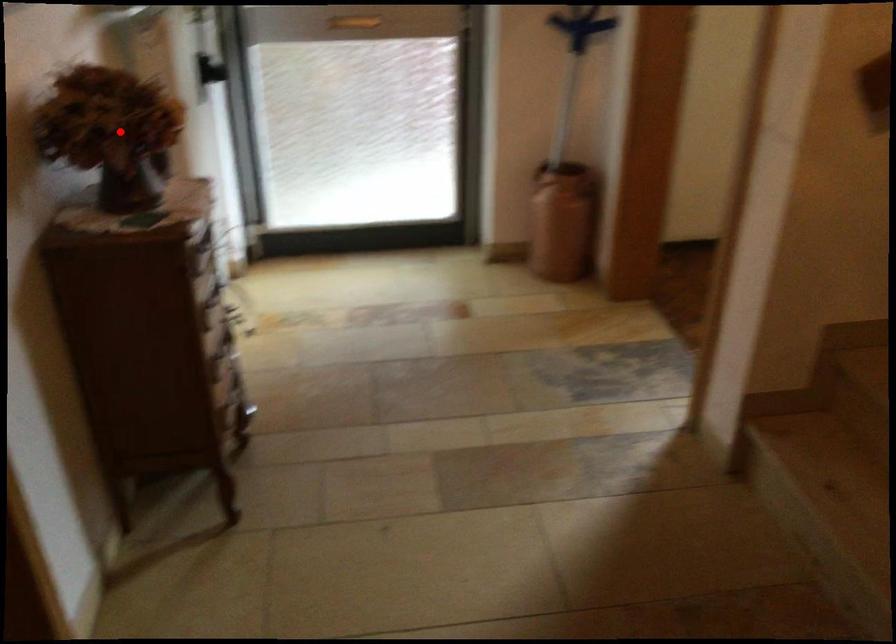
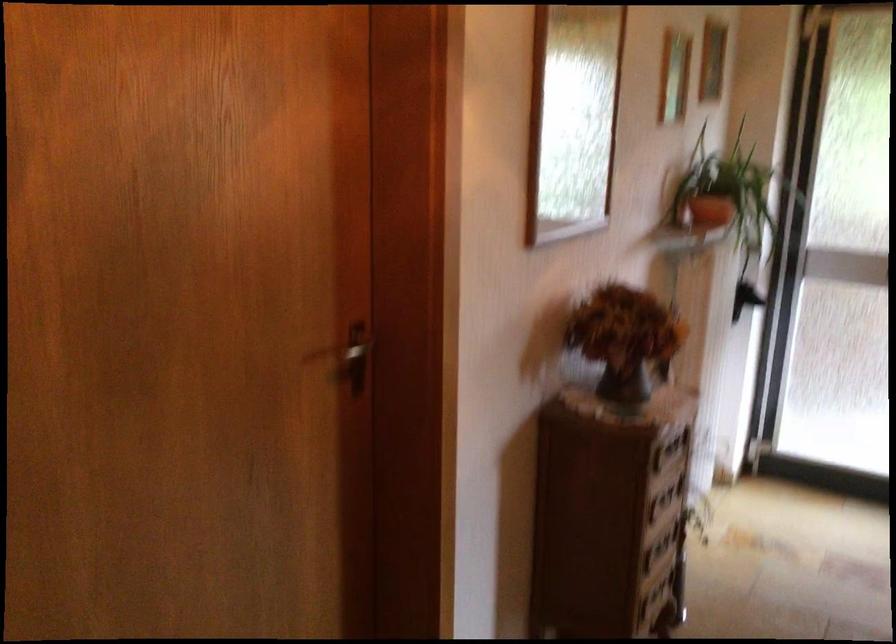
Where in the second image is the point corresponding to the highlighted location from the first image?

(624, 339)